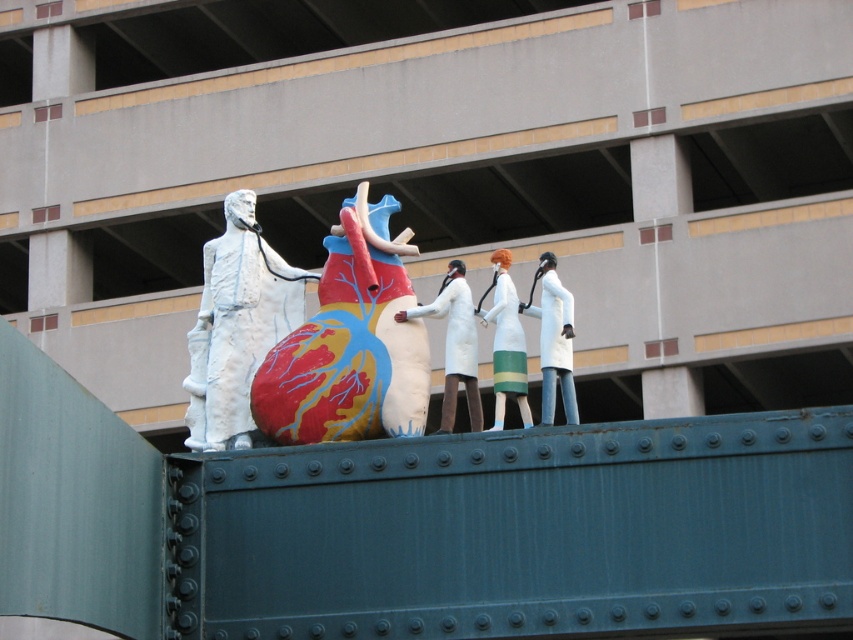
Is the position of white matte coat at center less distant than that of white matte dress at center?

Yes, white matte coat at center is in front of white matte dress at center.

Is point (543, 420) positioned in front of point (505, 340)?

Yes, it is.

Who is more distant from viewer, (560, 378) or (524, 413)?

Positioned behind is point (560, 378).

Locate an element on the screen. white matte coat at center is located at coordinates (554, 340).

Is point (242, 400) farther from viewer compared to point (445, 308)?

That is True.

How much distance is there between white matte statue at center and white matte lab coat at center?

3.96 meters

This screenshot has width=853, height=640. What do you see at coordinates (236, 324) in the screenshot?
I see `white matte statue at center` at bounding box center [236, 324].

Where is `white matte statue at center`? The image size is (853, 640). white matte statue at center is located at coordinates (236, 324).

Can you confirm if white matte statue at center is bigger than white matte coat at center?

Yes.

Is white matte statue at center below white matte coat at center?

No, white matte statue at center is not below white matte coat at center.

What do you see at coordinates (236, 324) in the screenshot? I see `white matte statue at center` at bounding box center [236, 324].

Locate an element on the screen. The image size is (853, 640). white matte statue at center is located at coordinates (236, 324).